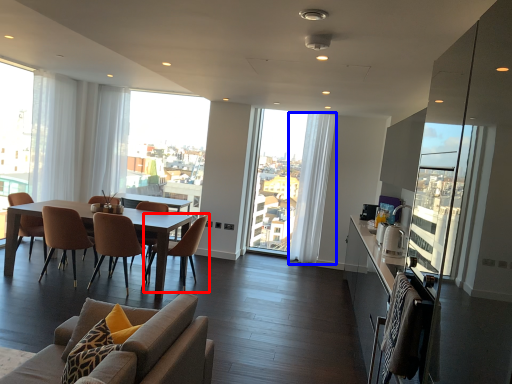
Question: Which object is further to the camera taking this photo, chair (highlighted by a red box) or curtain (highlighted by a blue box)?

Choices:
 (A) chair
 (B) curtain

Answer: (B)